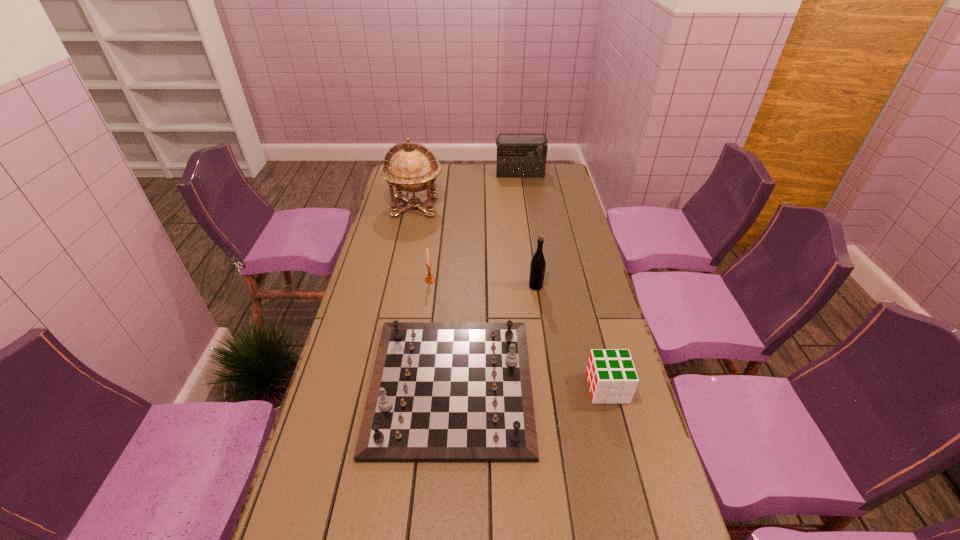
Where is `free spot between the chessboard and the second farthest object`? free spot between the chessboard and the second farthest object is located at coordinates (433, 296).

Point out which object is positioned as the third nearest to the farthest object. Please provide its 2D coordinates. Your answer should be formatted as a tuple, i.e. [(x, y)], where the tuple contains the x and y coordinates of a point satisfying the conditions above.

[(429, 279)]

Point out which object is positioned as the fifth nearest to the candle_holder. Please provide its 2D coordinates. Your answer should be formatted as a tuple, i.e. [(x, y)], where the tuple contains the x and y coordinates of a point satisfying the conditions above.

[(516, 157)]

Identify the location of free space that satisfies the following two spatial constraints: 1. on the front-facing side of the fourth shortest object; 2. on the left side of the globe. (398, 286).

This screenshot has width=960, height=540. Find the location of `free space in the image that satisfies the following two spatial constraints: 1. on the front-facing side of the candle_holder; 2. on the right side of the globe`. free space in the image that satisfies the following two spatial constraints: 1. on the front-facing side of the candle_holder; 2. on the right side of the globe is located at coordinates (400, 280).

Where is `vacant region that satisfies the following two spatial constraints: 1. on the front side of the candle_holder; 2. on the left side of the third tallest object`? This screenshot has height=540, width=960. vacant region that satisfies the following two spatial constraints: 1. on the front side of the candle_holder; 2. on the left side of the third tallest object is located at coordinates (429, 286).